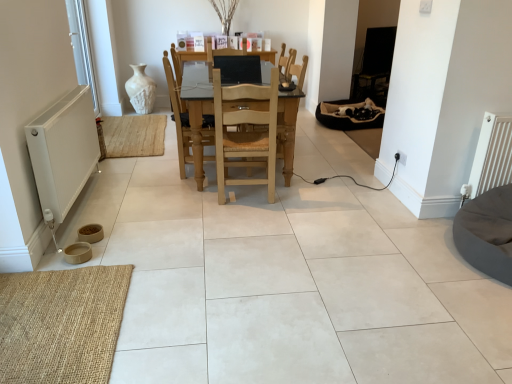
The width and height of the screenshot is (512, 384). I want to click on empty space that is ontop of burlap mat at lower left, so click(50, 312).